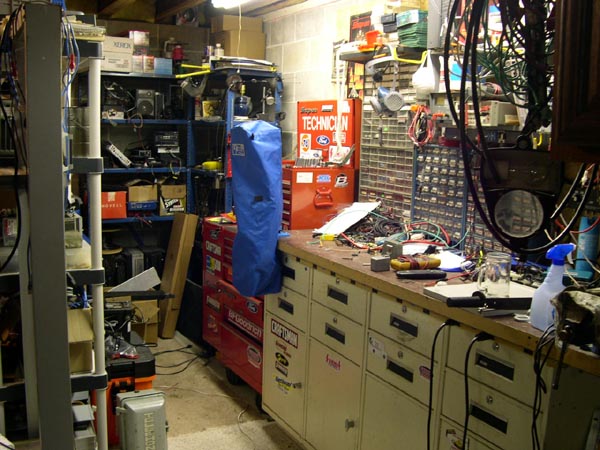
You are a GUI agent. You are given a task and a screenshot of the screen. Output one action in this format:
    pyautogui.click(x=<x>, y=<y>)
    Task: Click on the cinderblock wall
    The width and height of the screenshot is (600, 450).
    Given the screenshot: What is the action you would take?
    pyautogui.click(x=296, y=43)